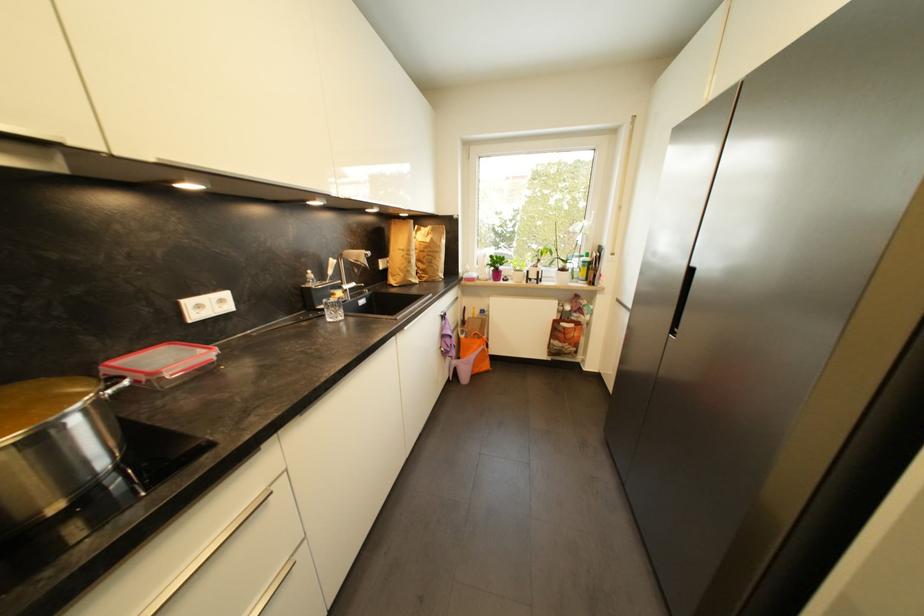
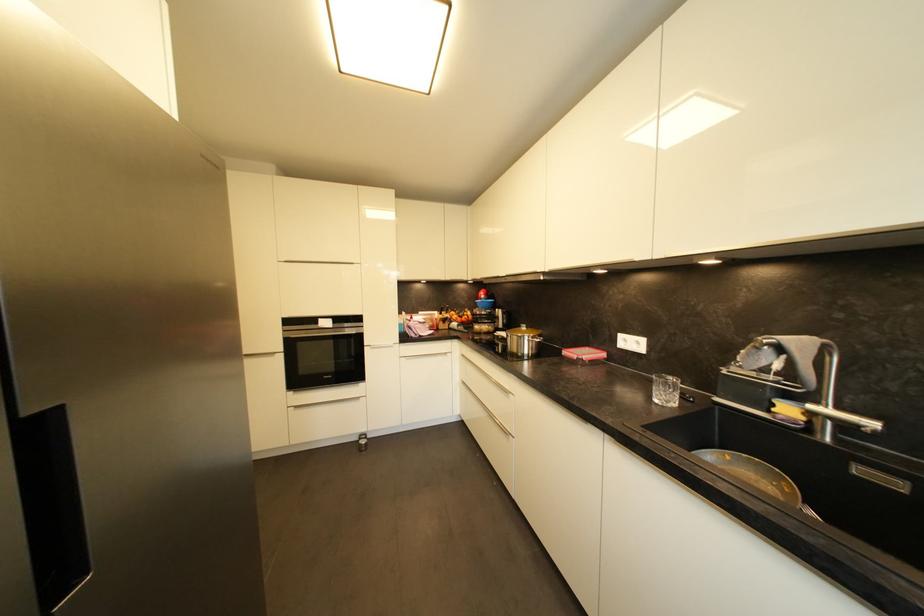
Find the pixel in the second image that matches (226,302) in the first image.

(642, 345)